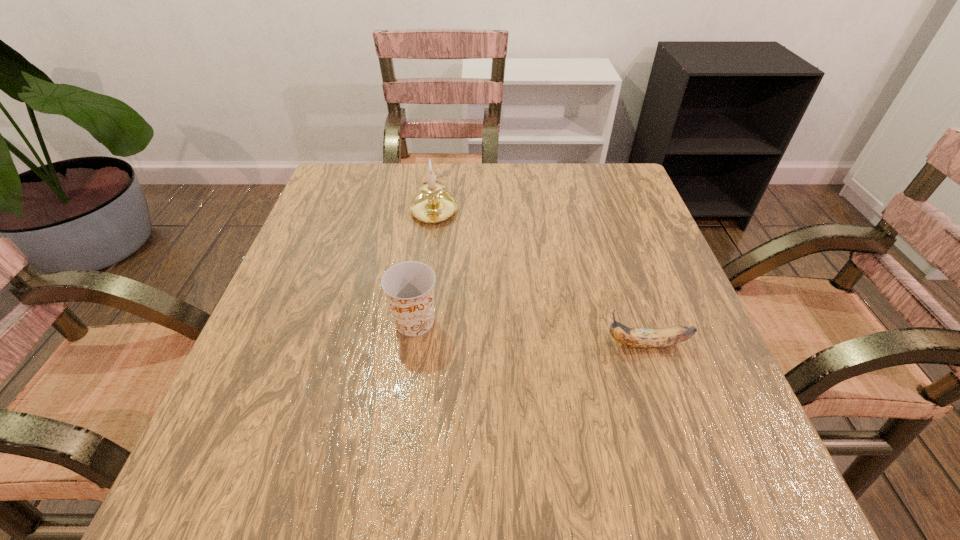
This screenshot has width=960, height=540. Find the location of `vacant area between the second tallest object and the shortest object`. vacant area between the second tallest object and the shortest object is located at coordinates (531, 333).

The height and width of the screenshot is (540, 960). In order to click on free space between the second tallest object and the shortest object in this screenshot , I will do `click(531, 333)`.

This screenshot has height=540, width=960. What are the coordinates of `vacant area that lies between the tallest object and the rightmost object` in the screenshot? It's located at (540, 276).

Where is `vacant space in between the shortest object and the second shortest object`? vacant space in between the shortest object and the second shortest object is located at coordinates (531, 333).

At what (x,y) coordinates should I click in order to perform the action: click on free spot between the rightmost object and the farthest object. Please return your answer as a coordinate pair (x, y). This screenshot has height=540, width=960. Looking at the image, I should click on (540, 276).

At what (x,y) coordinates should I click in order to perform the action: click on vacant space that is in between the rightmost object and the Dixie cup. Please return your answer as a coordinate pair (x, y). Looking at the image, I should click on click(531, 333).

The image size is (960, 540). Identify the location of empty space that is in between the shortest object and the Dixie cup. (531, 333).

Where is `object that is the nearest to the second shortest object`? object that is the nearest to the second shortest object is located at coordinates (433, 204).

Identify the location of object that is the second nearest to the rightmost object. (433, 204).